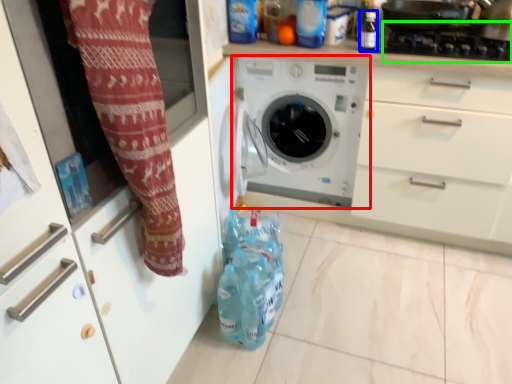
Question: Which object is positioned closest to washing machine (highlighted by a red box)? Select from bottle (highlighted by a blue box) and gas stove (highlighted by a green box).

Choices:
 (A) bottle
 (B) gas stove

Answer: (A)